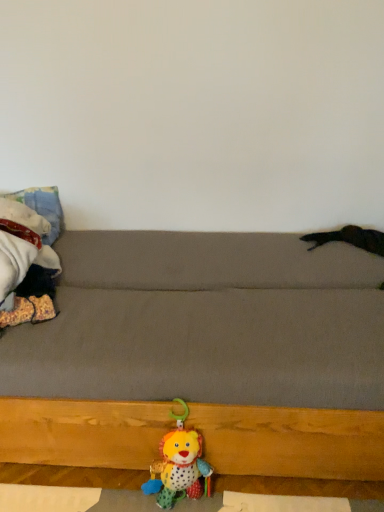
Question: Based on their positions, is soft plush lion at lower center, which ranks as the second toy in top-to-bottom order, located to the left or right of gray fabric couch at center?

Choices:
 (A) right
 (B) left

Answer: (A)

Question: Is soft plush lion at lower center, which ranks as the second toy in top-to-bottom order, wider or thinner than gray fabric couch at center?

Choices:
 (A) thin
 (B) wide

Answer: (A)

Question: Estimate the real-world distances between objects in this image. Which object is farther from the fluffy fabric blanket at left, which is the 2th toy in bottom-to-top order?

Choices:
 (A) soft plush lion at lower center, which is counted as the 2th toy, starting from the left
 (B) gray fabric couch at center

Answer: (A)

Question: Which of these objects is positioned farthest from the soft plush lion at lower center, which ranks as the second toy in top-to-bottom order?

Choices:
 (A) gray fabric couch at center
 (B) fluffy fabric blanket at left, which is the 2th toy in right-to-left order

Answer: (B)